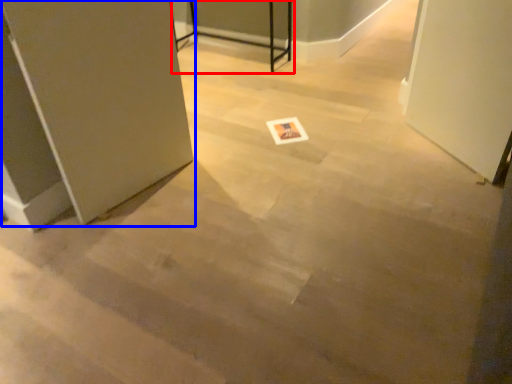
Question: Which object is further to the camera taking this photo, table (highlighted by a red box) or door (highlighted by a blue box)?

Choices:
 (A) table
 (B) door

Answer: (A)